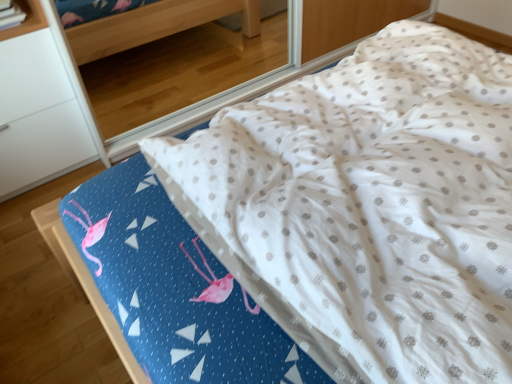
Question: Should I look upward or downward to see white matte shelf at upper left?

Choices:
 (A) up
 (B) down

Answer: (A)

Question: Can you confirm if white matte shelf at upper left is smaller than white matte cabinet at left?

Choices:
 (A) yes
 (B) no

Answer: (A)

Question: Considering the relative positions of white matte shelf at upper left and white matte cabinet at left in the image provided, is white matte shelf at upper left to the right of white matte cabinet at left from the viewer's perspective?

Choices:
 (A) no
 (B) yes

Answer: (B)

Question: Can you confirm if white matte shelf at upper left is bigger than white matte cabinet at left?

Choices:
 (A) yes
 (B) no

Answer: (B)

Question: Could you tell me if white matte shelf at upper left is turned towards white matte cabinet at left?

Choices:
 (A) no
 (B) yes

Answer: (A)

Question: Does white matte shelf at upper left come in front of white matte cabinet at left?

Choices:
 (A) no
 (B) yes

Answer: (A)

Question: Is the position of white matte shelf at upper left more distant than that of white matte cabinet at left?

Choices:
 (A) yes
 (B) no

Answer: (A)

Question: Is the position of white matte cabinet at left more distant than that of white matte shelf at upper left?

Choices:
 (A) yes
 (B) no

Answer: (B)

Question: Is white matte cabinet at left touching white matte shelf at upper left?

Choices:
 (A) no
 (B) yes

Answer: (A)

Question: From a real-world perspective, is white matte cabinet at left below white matte shelf at upper left?

Choices:
 (A) no
 (B) yes

Answer: (B)

Question: Is white matte cabinet at left wider than white matte shelf at upper left?

Choices:
 (A) yes
 (B) no

Answer: (A)

Question: Considering the relative sizes of white matte cabinet at left and white matte shelf at upper left in the image provided, is white matte cabinet at left shorter than white matte shelf at upper left?

Choices:
 (A) yes
 (B) no

Answer: (B)

Question: Is white matte shelf at upper left at the back of white matte cabinet at left?

Choices:
 (A) no
 (B) yes

Answer: (A)

Question: From the image's perspective, is white matte shelf at upper left positioned above or below white matte cabinet at left?

Choices:
 (A) above
 (B) below

Answer: (A)